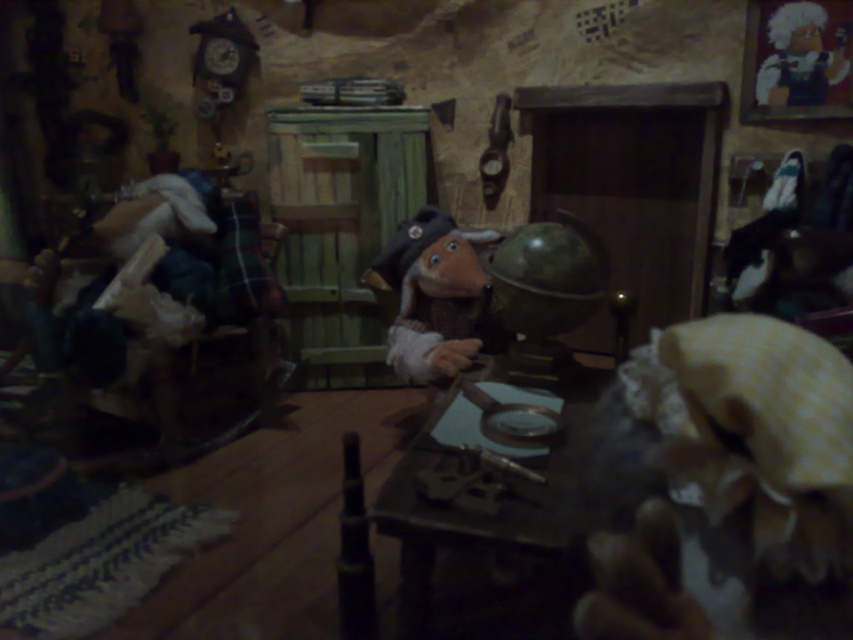
How far apart are wooden table at center and matte brown wooden toy at center?

wooden table at center is 27.59 inches away from matte brown wooden toy at center.

Is wooden table at center further to the viewer compared to matte brown wooden toy at center?

No.

Measure the distance between wooden table at center and camera.

wooden table at center and camera are 1.27 meters apart from each other.

Where is `wooden table at center`? wooden table at center is located at coordinates (486, 531).